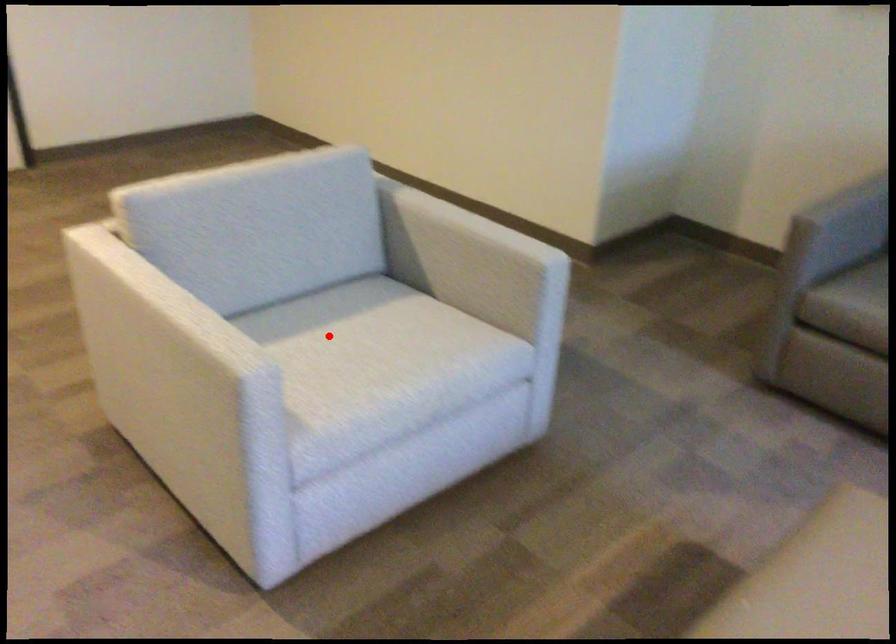
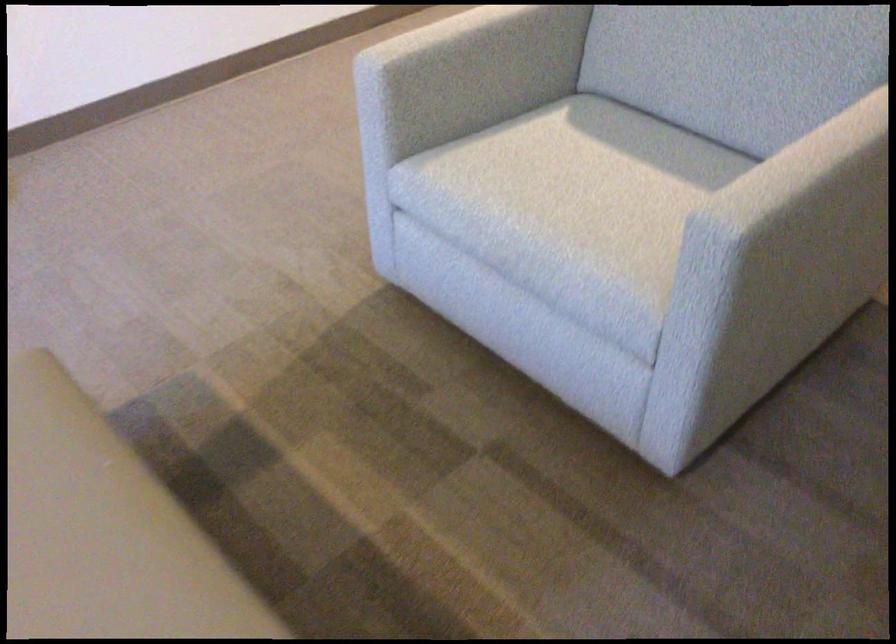
Question: A red point is marked in image1. In image2, is the corresponding 3D point closer to the camera or farther? Reply with the corresponding letter.

Choices:
 (A) The corresponding 3D point is closer.
 (B) The corresponding 3D point is farther.

Answer: (A)